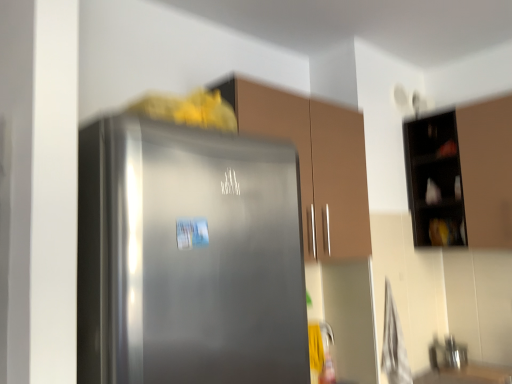
Describe the element at coordinates (447, 354) in the screenshot. This screenshot has height=384, width=512. I see `metallic stainless steel sink at lower right` at that location.

You are a GUI agent. You are given a task and a screenshot of the screen. Output one action in this format:
    pyautogui.click(x=<x>, y=<y>)
    Task: Click on the smooth wooden counter top at lower right
    The width and height of the screenshot is (512, 384).
    Given the screenshot: What is the action you would take?
    pyautogui.click(x=467, y=375)

You are a GUI agent. You are given a task and a screenshot of the screen. Output one action in this format:
    pyautogui.click(x=<x>, y=<y>)
    Task: Click on the satin silver refrigerator at center
    The height and width of the screenshot is (384, 512).
    Given the screenshot: What is the action you would take?
    pyautogui.click(x=188, y=257)

Identify the location of metallic stainless steel sink at lower right. (447, 354).

Could you tell me if matte brown cabinet at center, the first cabinetry positioned from the left, is facing satin silver refrigerator at center?

No, matte brown cabinet at center, the first cabinetry positioned from the left, is not aimed at satin silver refrigerator at center.

Find the location of a particular element. Image resolution: width=512 pixels, height=384 pixels. refrigerator below the matte brown cabinet at center, the second cabinetry when ordered from right to left (from a real-world perspective) is located at coordinates (188, 257).

The height and width of the screenshot is (384, 512). In the image, there is a matte brown cabinet at center, the second cabinetry when ordered from right to left. In order to click on sink below it (from the image's perspective) in this screenshot , I will do `click(447, 354)`.

Would you consider metallic stainless steel sink at lower right to be distant from matte brown cabinet at center, the second cabinetry when ordered from right to left?

metallic stainless steel sink at lower right is far away from matte brown cabinet at center, the second cabinetry when ordered from right to left.

Considering the relative sizes of metallic stainless steel sink at lower right and matte brown cabinet at center, the first cabinetry positioned from the left, in the image provided, is metallic stainless steel sink at lower right smaller than matte brown cabinet at center, the first cabinetry positioned from the left,?

Yes.

Which object is further away from the camera taking this photo, metallic stainless steel sink at lower right or matte brown cabinet at center, the second cabinetry when ordered from right to left?

Positioned behind is metallic stainless steel sink at lower right.

How different are the orientations of satin silver refrigerator at center and matte brown cabinet at center, the second cabinetry when ordered from right to left, in degrees?

1.72e-05 degrees separate the facing orientations of satin silver refrigerator at center and matte brown cabinet at center, the second cabinetry when ordered from right to left.

Is satin silver refrigerator at center facing towards matte brown cabinet at center, the second cabinetry when ordered from right to left?

No, satin silver refrigerator at center is not facing towards matte brown cabinet at center, the second cabinetry when ordered from right to left.

Is satin silver refrigerator at center completely or partially outside of matte brown cabinet at center, the second cabinetry when ordered from right to left?

Yes, satin silver refrigerator at center is located beyond the bounds of matte brown cabinet at center, the second cabinetry when ordered from right to left.

Is the position of satin silver refrigerator at center more distant than that of matte brown cabinet at center, the first cabinetry positioned from the left?

No, satin silver refrigerator at center is closer to the camera.

Does smooth wooden counter top at lower right come in front of black matte cabinet at upper right, which appears as the 2th cabinetry when viewed from the left?

Yes, the depth of smooth wooden counter top at lower right is less than that of black matte cabinet at upper right, which appears as the 2th cabinetry when viewed from the left.

How much distance is there between smooth wooden counter top at lower right and black matte cabinet at upper right, which appears as the 2th cabinetry when viewed from the left?

smooth wooden counter top at lower right and black matte cabinet at upper right, which appears as the 2th cabinetry when viewed from the left, are 35.25 inches apart from each other.

This screenshot has width=512, height=384. What are the coordinates of `cabinetry behind the smooth wooden counter top at lower right` in the screenshot? It's located at (461, 175).

Is smooth wooden counter top at lower right spatially inside black matte cabinet at upper right, which appears as the 2th cabinetry when viewed from the left, or outside of it?

smooth wooden counter top at lower right is outside black matte cabinet at upper right, which appears as the 2th cabinetry when viewed from the left.

Can you confirm if black matte cabinet at upper right, which appears as the 2th cabinetry when viewed from the left, is bigger than metallic stainless steel sink at lower right?

Correct, black matte cabinet at upper right, which appears as the 2th cabinetry when viewed from the left, is larger in size than metallic stainless steel sink at lower right.

Identify the location of cabinetry on the right of the metallic stainless steel sink at lower right. This screenshot has height=384, width=512. (461, 175).

Who is more distant, black matte cabinet at upper right, which is the 1th cabinetry from right to left, or metallic stainless steel sink at lower right?

metallic stainless steel sink at lower right is further away from the camera.

Is black matte cabinet at upper right, which is the 1th cabinetry from right to left, turned away from metallic stainless steel sink at lower right?

No, black matte cabinet at upper right, which is the 1th cabinetry from right to left,'s orientation is not away from metallic stainless steel sink at lower right.

Is matte brown cabinet at center, the second cabinetry when ordered from right to left, positioned behind black matte cabinet at upper right, which appears as the 2th cabinetry when viewed from the left?

No, matte brown cabinet at center, the second cabinetry when ordered from right to left, is in front of black matte cabinet at upper right, which appears as the 2th cabinetry when viewed from the left.

How many degrees apart are the facing directions of matte brown cabinet at center, the second cabinetry when ordered from right to left, and black matte cabinet at upper right, which is the 1th cabinetry from right to left?

The angle between the facing direction of matte brown cabinet at center, the second cabinetry when ordered from right to left, and the facing direction of black matte cabinet at upper right, which is the 1th cabinetry from right to left, is 88.8 degrees.

Is matte brown cabinet at center, the second cabinetry when ordered from right to left, looking in the opposite direction of black matte cabinet at upper right, which appears as the 2th cabinetry when viewed from the left?

matte brown cabinet at center, the second cabinetry when ordered from right to left, does not have its back to black matte cabinet at upper right, which appears as the 2th cabinetry when viewed from the left.

In the scene shown: Which object is positioned more to the right, black matte cabinet at upper right, which is the 1th cabinetry from right to left, or matte brown cabinet at center, the second cabinetry when ordered from right to left?

Positioned to the right is black matte cabinet at upper right, which is the 1th cabinetry from right to left.

Is black matte cabinet at upper right, which appears as the 2th cabinetry when viewed from the left, inside or outside of matte brown cabinet at center, the first cabinetry positioned from the left?

black matte cabinet at upper right, which appears as the 2th cabinetry when viewed from the left, is not enclosed by matte brown cabinet at center, the first cabinetry positioned from the left.

Looking at this image, from the image's perspective, which one is positioned higher, black matte cabinet at upper right, which appears as the 2th cabinetry when viewed from the left, or matte brown cabinet at center, the first cabinetry positioned from the left?

black matte cabinet at upper right, which appears as the 2th cabinetry when viewed from the left, from the image's perspective.

Is black matte cabinet at upper right, which appears as the 2th cabinetry when viewed from the left, oriented away from matte brown cabinet at center, the first cabinetry positioned from the left?

No.

From the image's perspective, count 1st cabinetrys upward from the satin silver refrigerator at center and point to it. Please provide its 2D coordinates.

[(314, 162)]

The image size is (512, 384). There is a metallic stainless steel sink at lower right. Find the location of `the 1st cabinetry above it (from a real-world perspective)`. the 1st cabinetry above it (from a real-world perspective) is located at coordinates (314, 162).

Consider the image. Estimate the real-world distances between objects in this image. Which object is further from satin silver refrigerator at center, metallic stainless steel sink at lower right or smooth wooden counter top at lower right?

The object further to satin silver refrigerator at center is metallic stainless steel sink at lower right.

Looking at the image, which one is located further to black matte cabinet at upper right, which is the 1th cabinetry from right to left, metallic stainless steel sink at lower right or matte brown cabinet at center, the first cabinetry positioned from the left?

Among the two, metallic stainless steel sink at lower right is located further to black matte cabinet at upper right, which is the 1th cabinetry from right to left.

When comparing their distances from black matte cabinet at upper right, which is the 1th cabinetry from right to left, does satin silver refrigerator at center or matte brown cabinet at center, the second cabinetry when ordered from right to left, seem closer?

matte brown cabinet at center, the second cabinetry when ordered from right to left, is closer to black matte cabinet at upper right, which is the 1th cabinetry from right to left.

From the image, which object appears to be farther from satin silver refrigerator at center, metallic stainless steel sink at lower right or matte brown cabinet at center, the first cabinetry positioned from the left?

metallic stainless steel sink at lower right is positioned further to the anchor satin silver refrigerator at center.

Looking at the image, which one is located closer to smooth wooden counter top at lower right, metallic stainless steel sink at lower right or black matte cabinet at upper right, which is the 1th cabinetry from right to left?

metallic stainless steel sink at lower right.

From the image, which object appears to be nearer to smooth wooden counter top at lower right, black matte cabinet at upper right, which is the 1th cabinetry from right to left, or satin silver refrigerator at center?

The object closer to smooth wooden counter top at lower right is black matte cabinet at upper right, which is the 1th cabinetry from right to left.

Estimate the real-world distances between objects in this image. Which object is closer to metallic stainless steel sink at lower right, satin silver refrigerator at center or black matte cabinet at upper right, which is the 1th cabinetry from right to left?

black matte cabinet at upper right, which is the 1th cabinetry from right to left, is positioned closer to the anchor metallic stainless steel sink at lower right.

In the scene shown: Looking at the image, which one is located further to matte brown cabinet at center, the second cabinetry when ordered from right to left, black matte cabinet at upper right, which is the 1th cabinetry from right to left, or satin silver refrigerator at center?

Based on the image, black matte cabinet at upper right, which is the 1th cabinetry from right to left, appears to be further to matte brown cabinet at center, the second cabinetry when ordered from right to left.

This screenshot has height=384, width=512. What are the coordinates of `cabinetry located between satin silver refrigerator at center and black matte cabinet at upper right, which appears as the 2th cabinetry when viewed from the left, in the depth direction` in the screenshot? It's located at (314, 162).

Where is `sink between matte brown cabinet at center, the second cabinetry when ordered from right to left, and smooth wooden counter top at lower right in the up-down direction`? sink between matte brown cabinet at center, the second cabinetry when ordered from right to left, and smooth wooden counter top at lower right in the up-down direction is located at coordinates (447, 354).

At what (x,y) coordinates should I click in order to perform the action: click on cabinetry between black matte cabinet at upper right, which is the 1th cabinetry from right to left, and smooth wooden counter top at lower right, in the vertical direction. Please return your answer as a coordinate pair (x, y). Looking at the image, I should click on (314, 162).

The image size is (512, 384). I want to click on sink situated between satin silver refrigerator at center and smooth wooden counter top at lower right from left to right, so click(x=447, y=354).